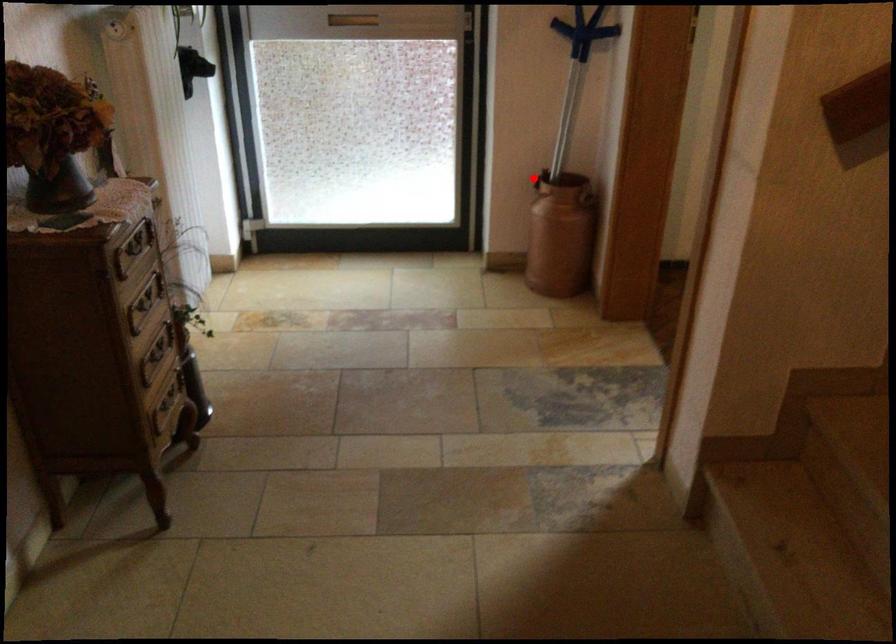
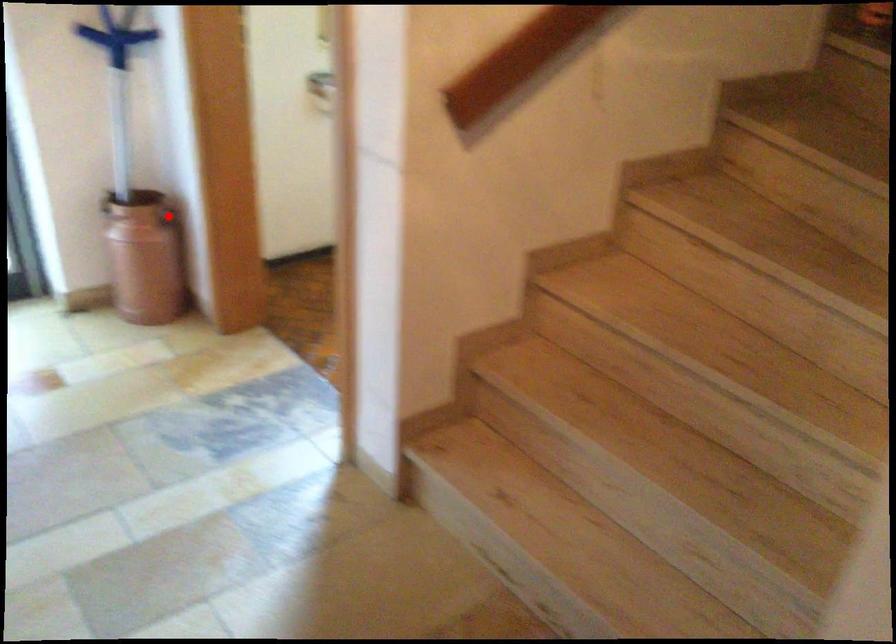
I am providing you with two images of the same scene from different viewpoints. A red point is marked on the first image and another point is marked on the second image. Do the highlighted points in image1 and image2 indicate the same real-world spot?

No